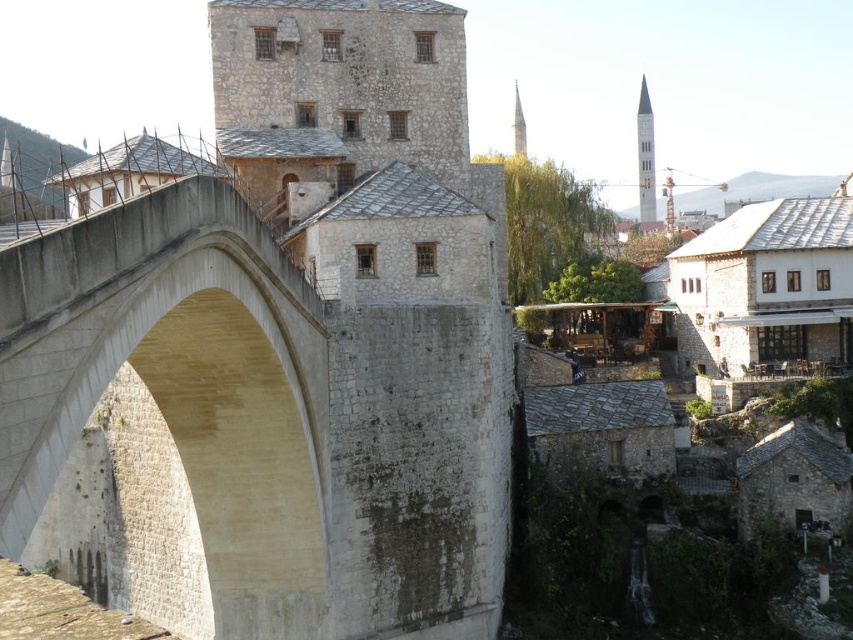
You are standing at the point marked by coordinates point (180, 385). Looking around, you see the beige stone arch bridge at left. Which direction should you face to look towards the beige stone arch bridge at left?

You should face towards the left to look towards the beige stone arch bridge at left since the point (180, 385) is located to the right of the bridge.

You are a tourist standing on the beige stone arch bridge at left and want to take a photo of the white stone tower at upper center. Based on their widths, which object would appear narrower in the photo?

The beige stone arch bridge at left would appear narrower in the photo because it has a lesser width compared to the white stone tower at upper center.

Based on the scene description, what are the coordinates of the white stone tower at upper center in the image?

The white stone tower at upper center is located at coordinates 0.245 and 0.757 in the image.